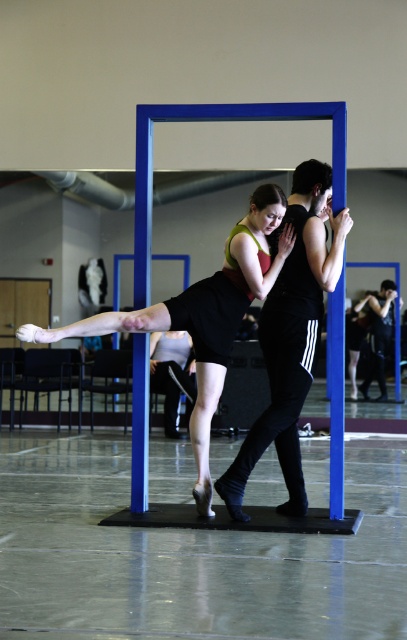
You are a photographer setting up a shoot in the dance studio. You need to place a small stool between the black matte pants at center and the dark blue jeans at center so that it doesn not block either of them. Where should you position the stool?

The stool should be placed between the black matte pants at center and the dark blue jeans at center, ensuring it is behind the black matte pants at center since it is in front of the dark blue jeans at center, allowing both items to remain visible without obstruction.

You are a photographer standing at the camera position. You need to capture a photo of the black matte pants at center. However, there is a mirror in the background that might reflect the camera. What is the minimum distance you should move forward so that the reflection of the camera is no longer visible in the mirror?

The minimum distance to move forward is 26.75 feet minus the distance from the mirror to the black matte pants at center. However, since the description only provides the distance between the black matte pants and the camera, we cannot determine the exact required distance without additional information about the mirror and pants positioning.